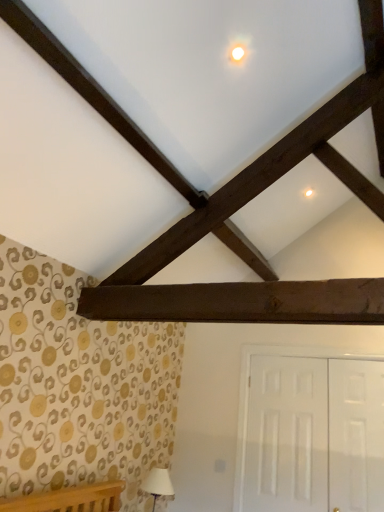
Question: Is white glossy door at lower right, which appears as the second door when viewed from the right, taller or shorter than white fabric lampshade at lower left?

Choices:
 (A) tall
 (B) short

Answer: (A)

Question: Choose the correct answer: Is white glossy door at lower right, the 1th door when ordered from left to right, inside white fabric lampshade at lower left or outside it?

Choices:
 (A) outside
 (B) inside

Answer: (A)

Question: Based on their relative distances, which object is farther from the dark brown wood plank at center?

Choices:
 (A) white glossy door at right, the second door when ordered from left to right
 (B) white fabric lampshade at lower left
 (C) white glossy door at lower right, the 1th door when ordered from left to right

Answer: (B)

Question: Considering the real-world distances, which object is closest to the white glossy door at lower right, the 1th door when ordered from left to right?

Choices:
 (A) white fabric lampshade at lower left
 (B) white glossy door at right, the second door when ordered from left to right
 (C) dark brown wood plank at center

Answer: (B)